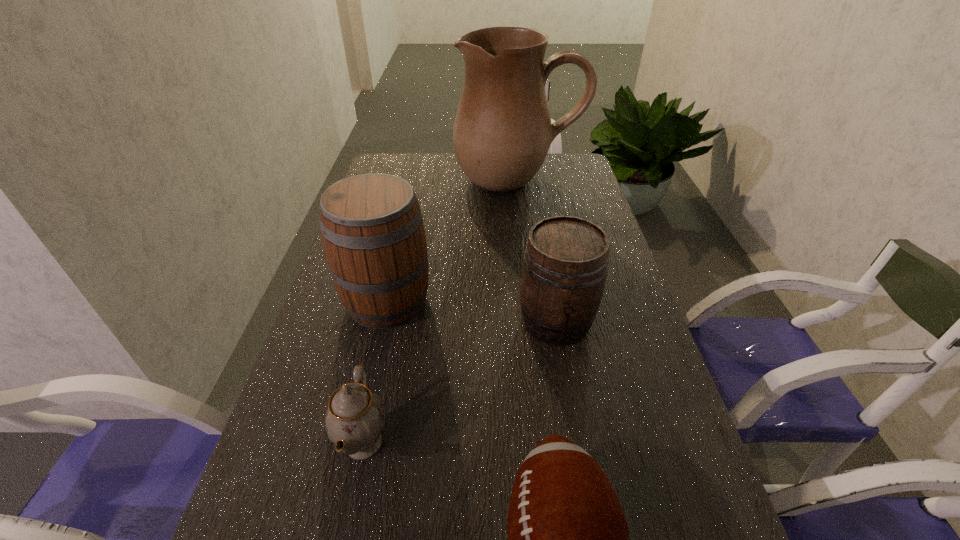
Locate an element on the screen. This screenshot has height=540, width=960. free spot that satisfies the following two spatial constraints: 1. at the spout of the farthest object; 2. on the spout of the chinaware is located at coordinates (552, 443).

The height and width of the screenshot is (540, 960). In order to click on free space that satisfies the following two spatial constraints: 1. at the spout of the cream pitcher; 2. on the spout of the chinaware in this screenshot , I will do `click(552, 443)`.